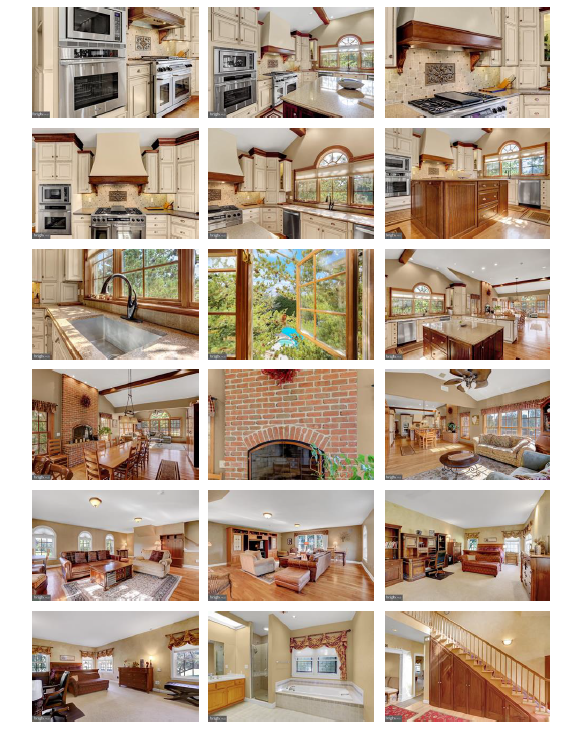
I want to click on other living spaces, so click(x=303, y=438), click(x=140, y=434), click(x=451, y=415), click(x=490, y=514), click(x=323, y=538), click(x=131, y=548), click(x=134, y=658), click(x=285, y=658), click(x=493, y=651).